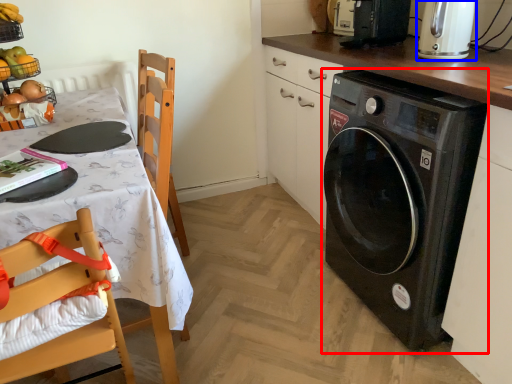
Question: Among these objects, which one is nearest to the camera, washing machine (highlighted by a red box) or kitchen appliance (highlighted by a blue box)?

Choices:
 (A) washing machine
 (B) kitchen appliance

Answer: (A)